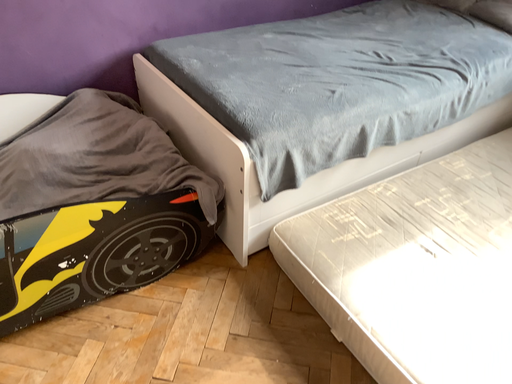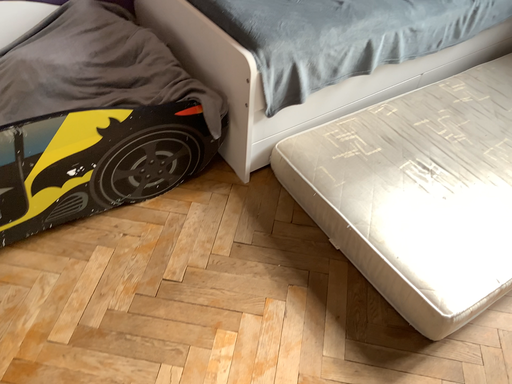
Question: Which way did the camera rotate in the video?

Choices:
 (A) rotated downward
 (B) rotated upward

Answer: (A)